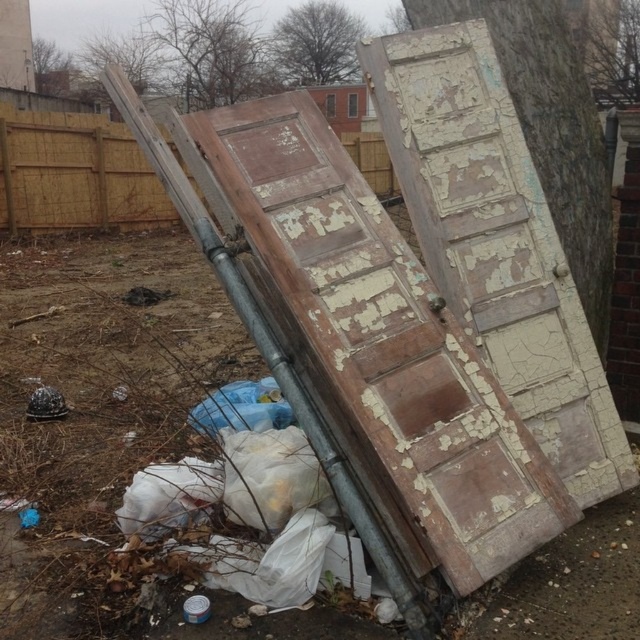
Can you confirm if peeling paint wood door at center is positioned to the left of wooden fence at upper left?

No, peeling paint wood door at center is not to the left of wooden fence at upper left.

Does peeling paint wood door at center come in front of wooden fence at upper left?

Yes, peeling paint wood door at center is in front of wooden fence at upper left.

This screenshot has height=640, width=640. What are the coordinates of `peeling paint wood door at center` in the screenshot? It's located at click(x=356, y=344).

The width and height of the screenshot is (640, 640). Find the location of `peeling paint wood door at center`. peeling paint wood door at center is located at coordinates (356, 344).